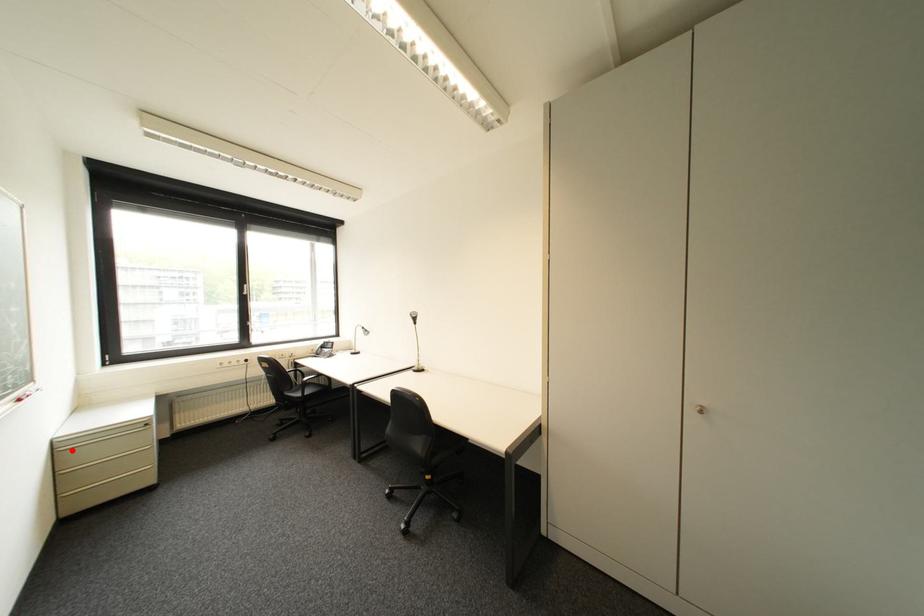
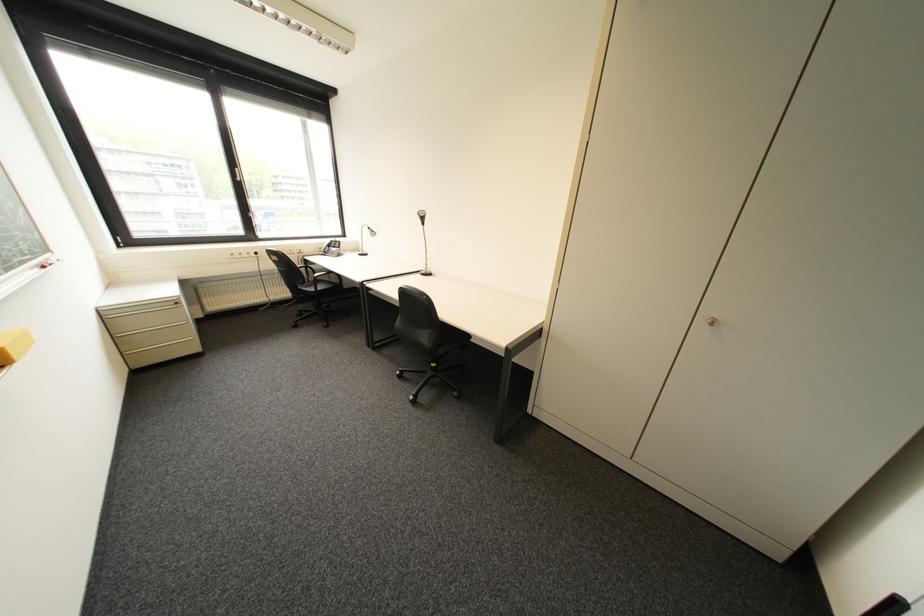
Question: I am providing you with two images of the same scene from different viewpoints. Given a red point in image1, look at the same physical point in image2. Is it:

Choices:
 (A) Closer to the viewpoint
 (B) Farther from the viewpoint

Answer: (A)